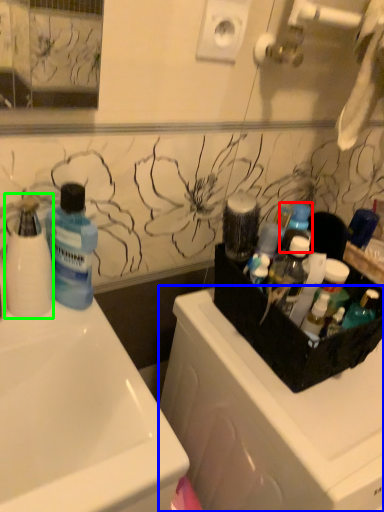
Question: Which object is positioned farthest from toiletry (highlighted by a red box)? Select from dish washer (highlighted by a blue box) and cleaning product (highlighted by a green box).

Choices:
 (A) dish washer
 (B) cleaning product

Answer: (B)